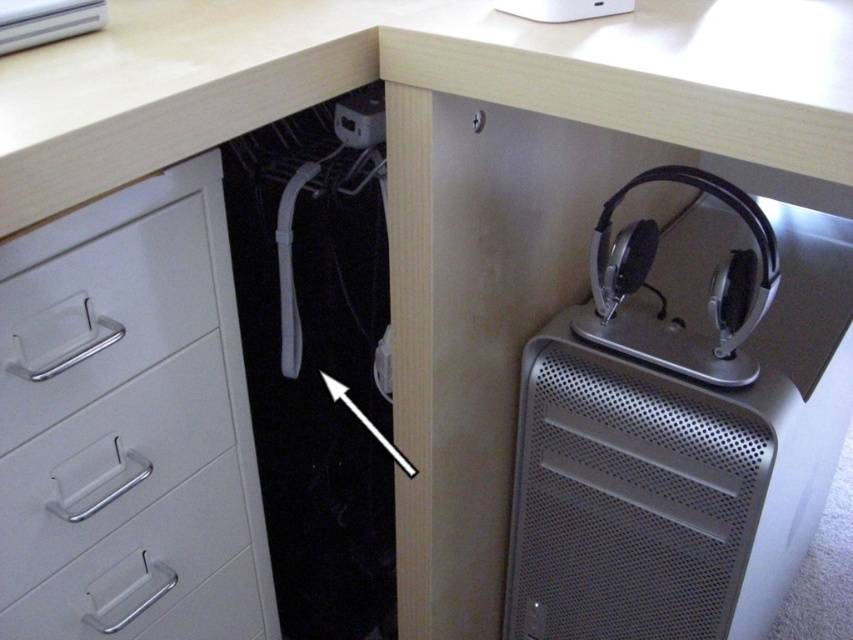
Question: Which object is farther from the camera taking this photo?

Choices:
 (A) white plastic file cabinet at left
 (B) metallic arrow at center

Answer: (B)

Question: Can you confirm if white plastic file cabinet at left is bigger than metallic arrow at center?

Choices:
 (A) yes
 (B) no

Answer: (A)

Question: Is white plastic file cabinet at left above metallic arrow at center?

Choices:
 (A) yes
 (B) no

Answer: (B)

Question: In this image, where is white plastic file cabinet at left located relative to metallic arrow at center?

Choices:
 (A) right
 (B) left

Answer: (B)

Question: Which of the following is the farthest from the observer?

Choices:
 (A) white plastic file cabinet at left
 (B) metallic arrow at center

Answer: (B)